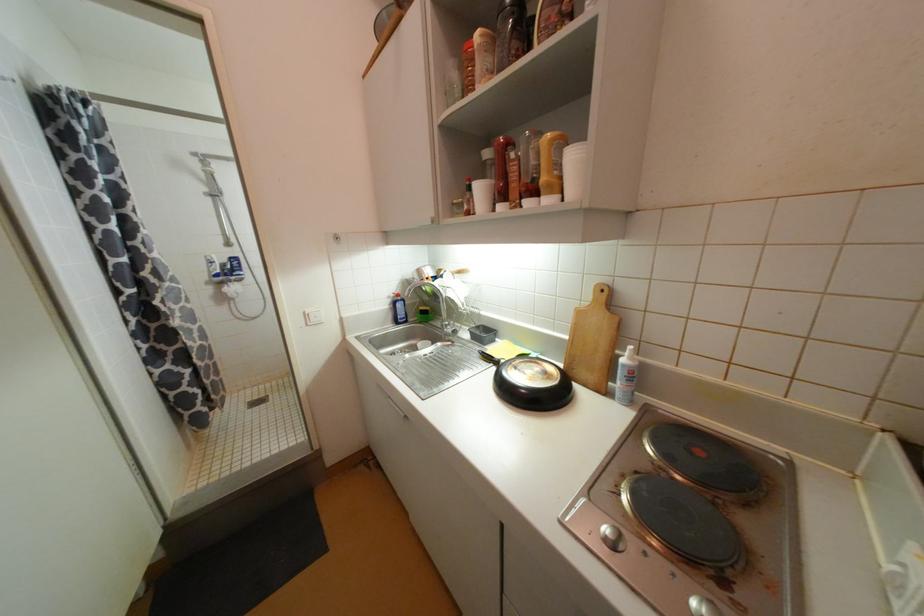
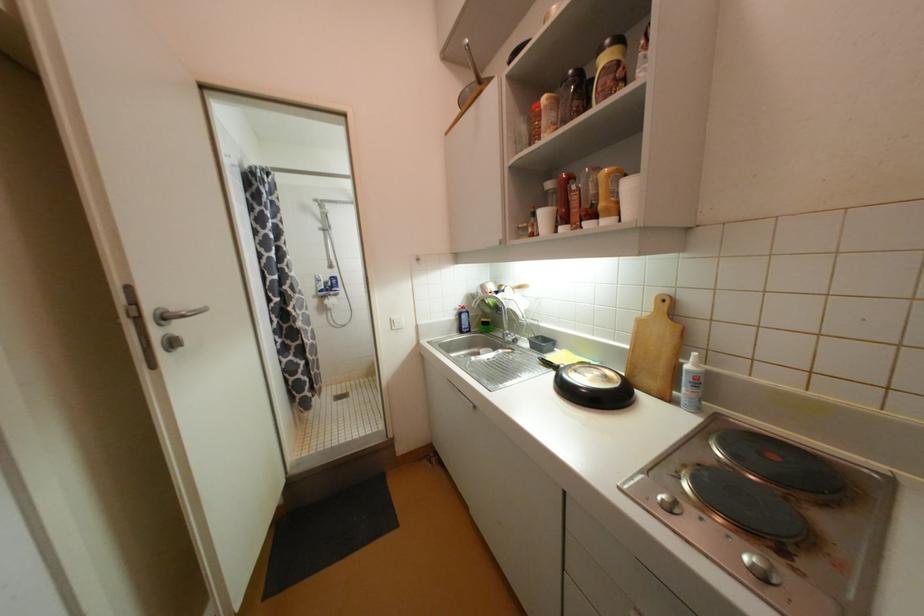
Find the pixel in the second image that matches (x=310, y=317) in the first image.

(396, 323)